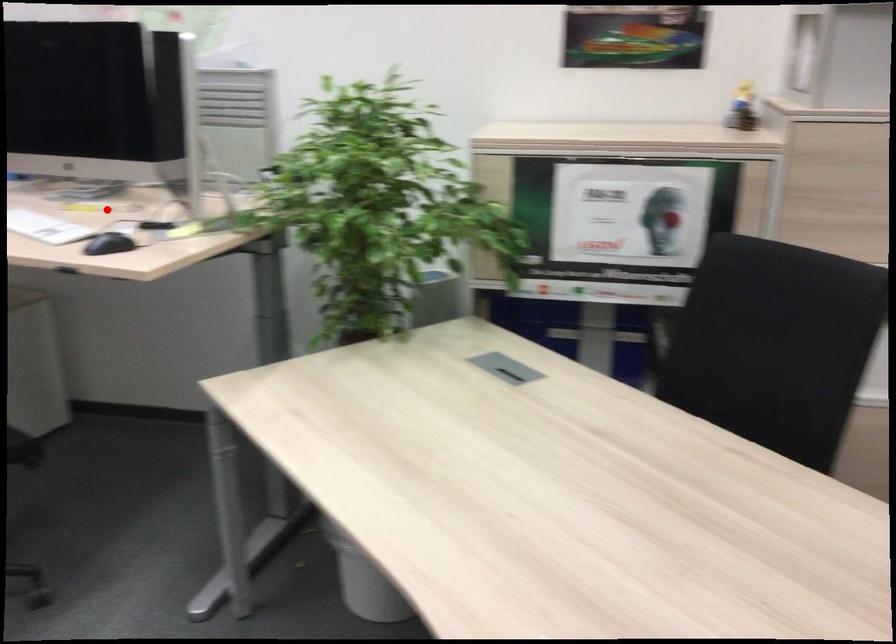
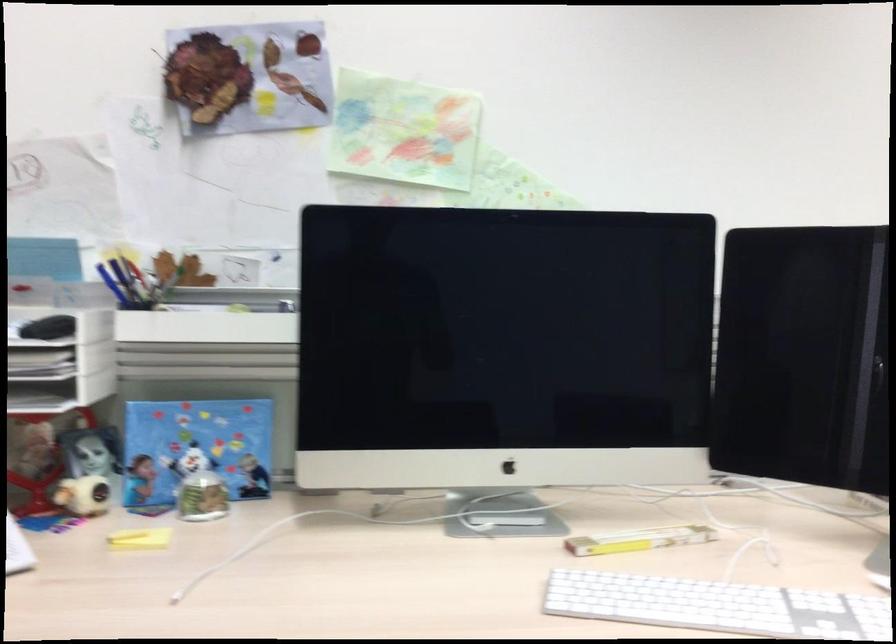
In the second image, find the point that corresponds to the highlighted location in the first image.

(638, 540)